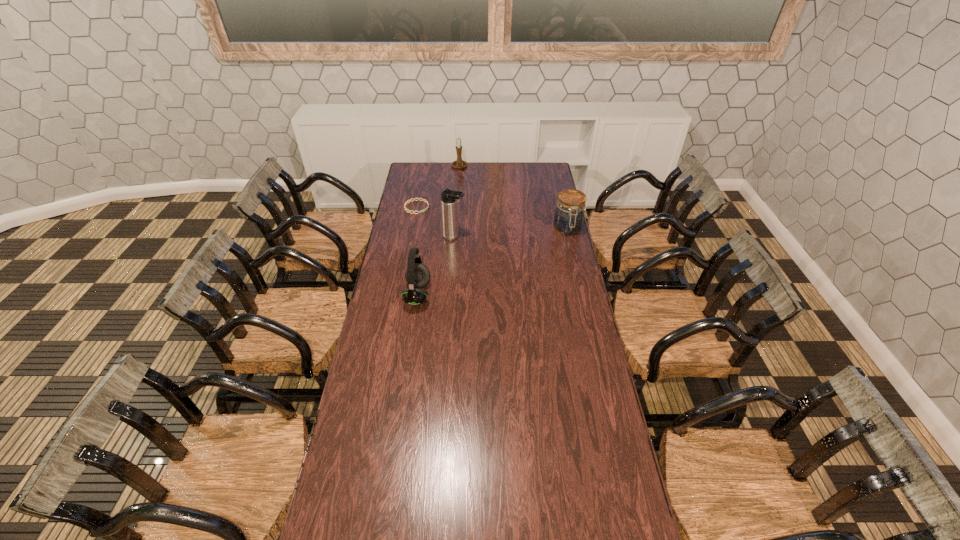
Identify the location of free space between the shortest object and the rightmost object. This screenshot has width=960, height=540. (492, 218).

Image resolution: width=960 pixels, height=540 pixels. I want to click on vacant space that is in between the rightmost object and the farthest object, so click(514, 198).

The image size is (960, 540). I want to click on empty space between the nearest object and the jar, so [x=492, y=262].

Find the location of a particular element. This screenshot has width=960, height=540. free space between the thermos bottle and the rightmost object is located at coordinates (511, 233).

Locate an element on the screen. free point between the thermos bottle and the headset is located at coordinates (436, 266).

At what (x,y) coordinates should I click in order to perform the action: click on object that stands as the fourth closest to the thermos bottle. Please return your answer as a coordinate pair (x, y). This screenshot has width=960, height=540. Looking at the image, I should click on click(x=459, y=163).

At what (x,y) coordinates should I click in order to perform the action: click on the third closest object relative to the headset. Please return your answer as a coordinate pair (x, y). The width and height of the screenshot is (960, 540). Looking at the image, I should click on (568, 219).